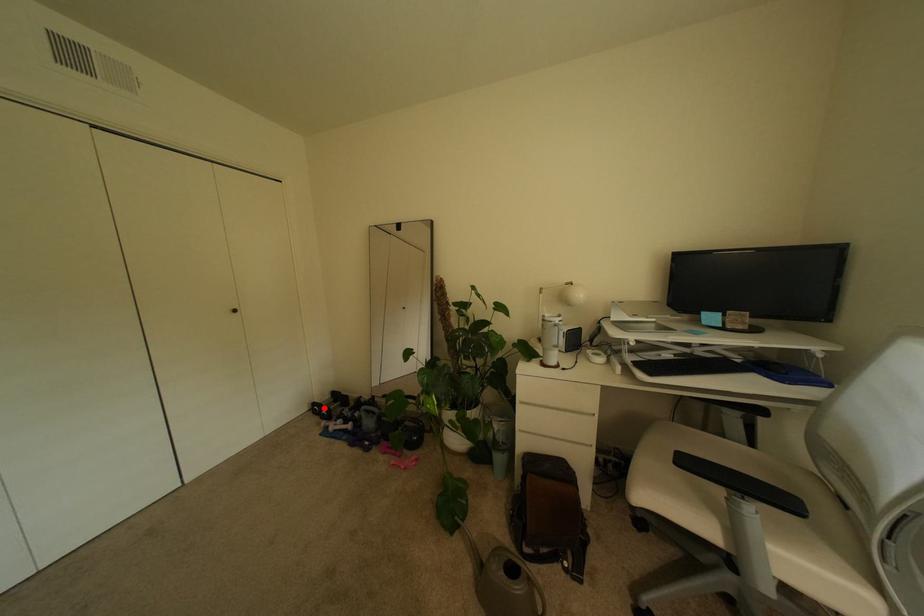
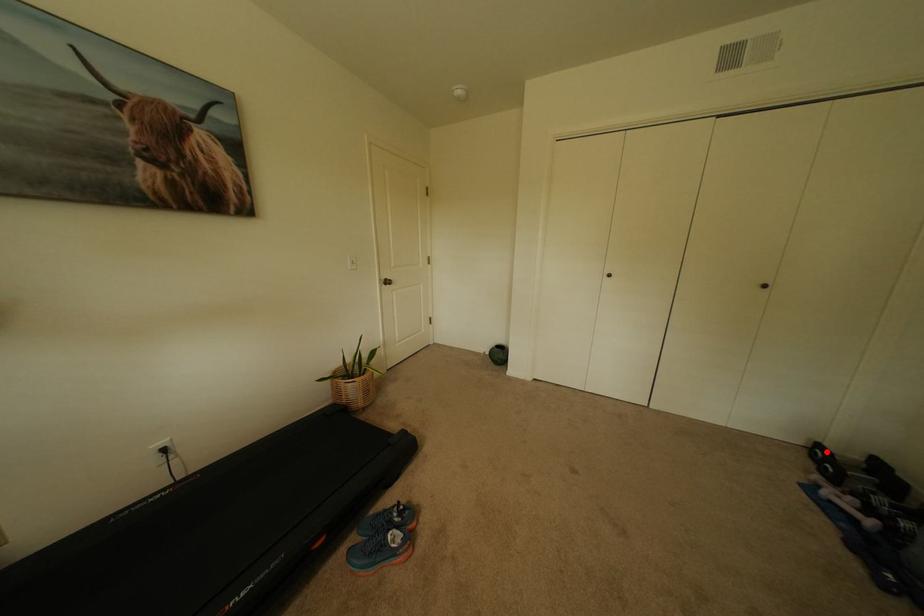
I am providing you with two images of the same scene from different viewpoints. A red point is marked on the first image and another point is marked on the second image. Is the marked point in image1 the same physical position as the marked point in image2?

Yes